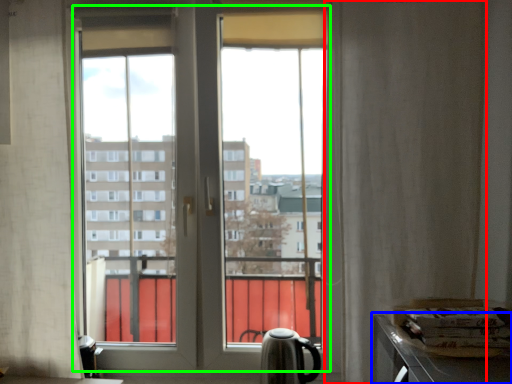
Question: Which object is the closest to the curtain (highlighted by a red box)? Choose among these: counter top (highlighted by a blue box) or bay window (highlighted by a green box).

Choices:
 (A) counter top
 (B) bay window

Answer: (A)